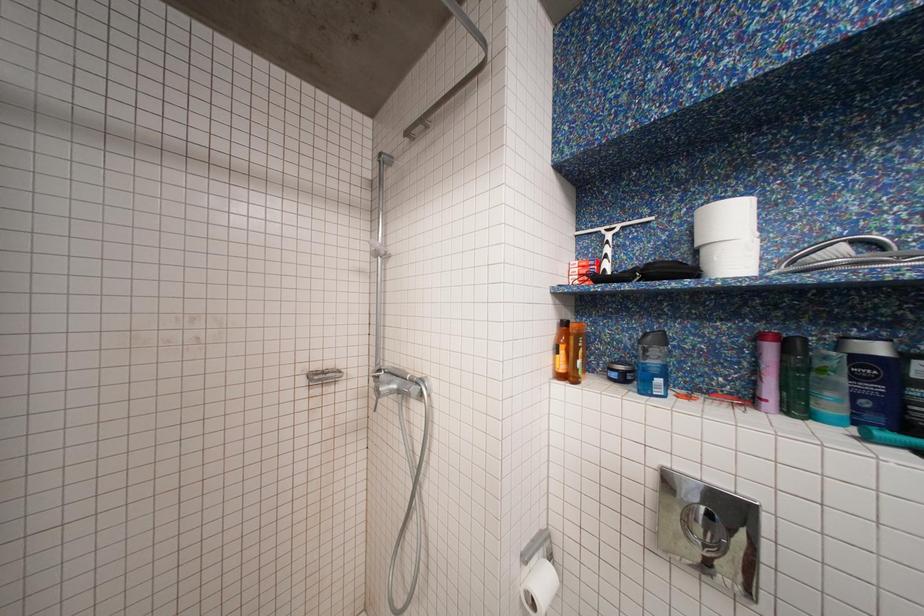
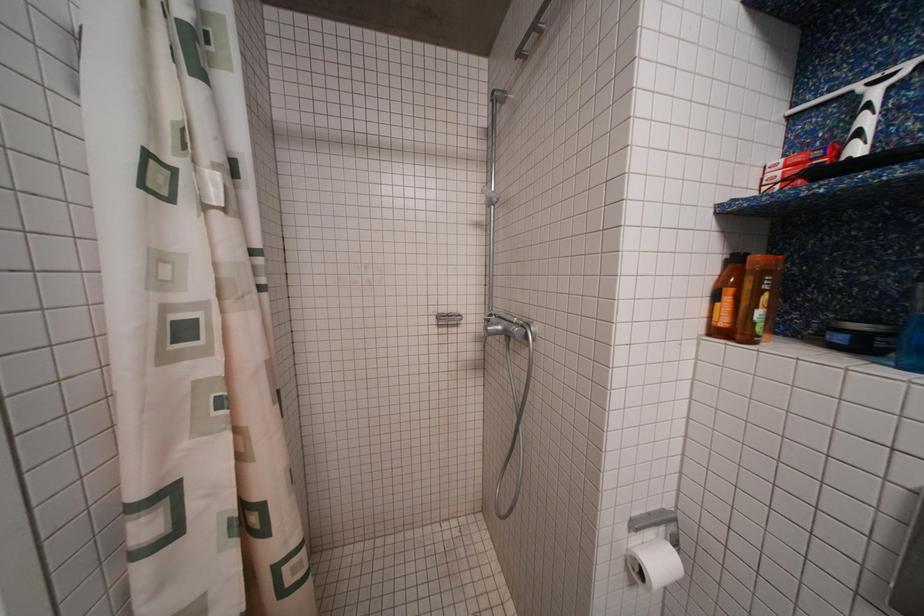
Question: The camera is either moving clockwise (left) or counter-clockwise (right) around the object. The first image is from the beginning of the video and the second image is from the end. Is the camera moving left or right when shooting the video?

Choices:
 (A) Left
 (B) Right

Answer: (B)